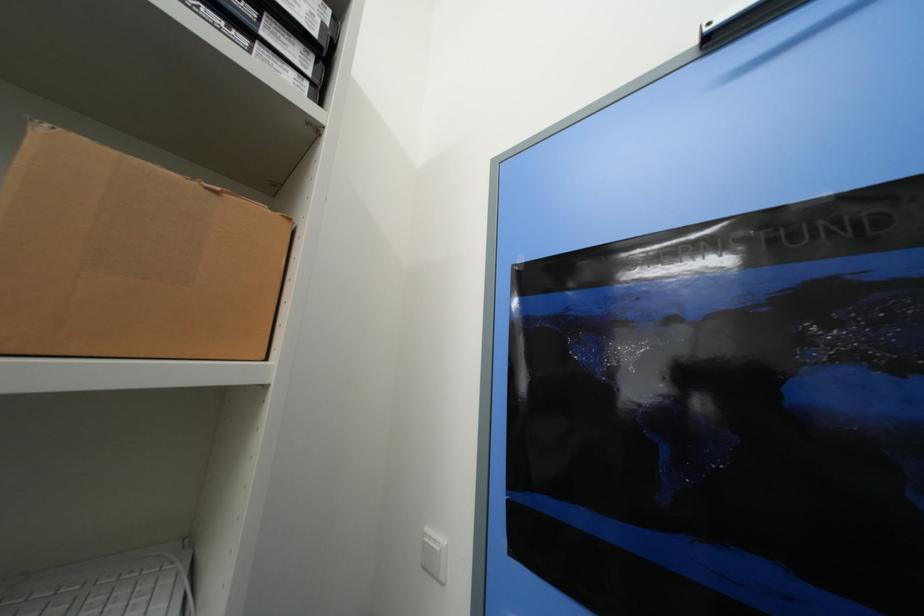
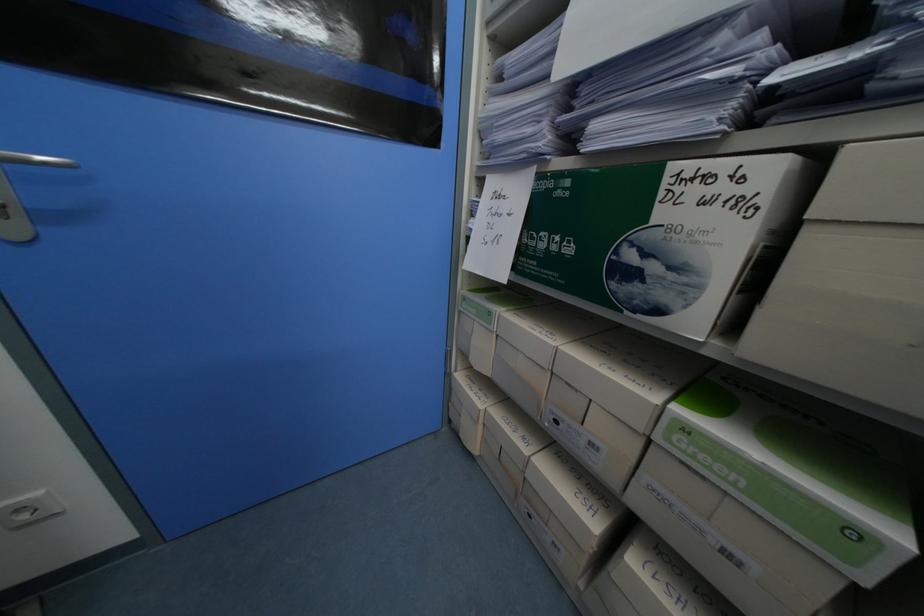
The first image is from the beginning of the video and the second image is from the end. How did the camera likely rotate when shooting the video?

The camera's rotation is toward right-down.